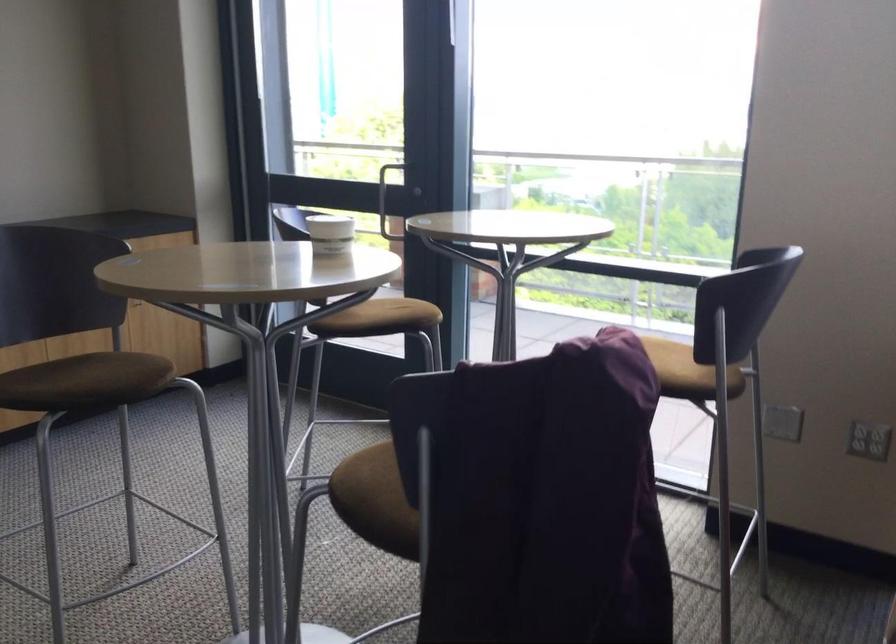
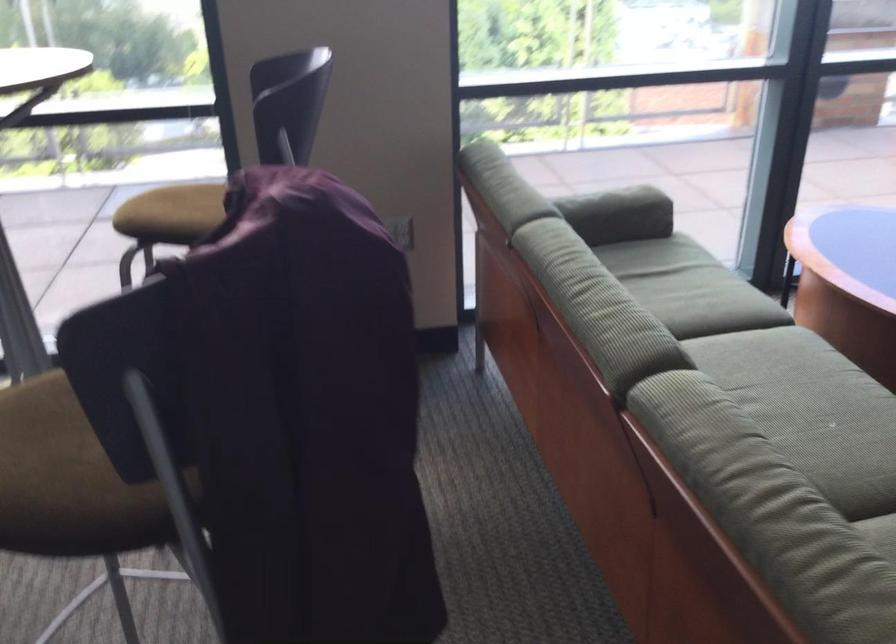
First-person continuous shooting, in which direction is the camera rotating?

The camera rotated toward right-down.